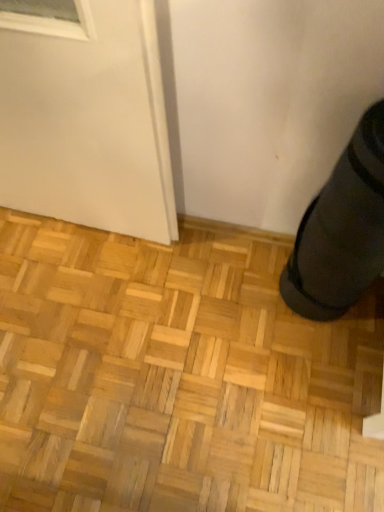
Identify the location of vacant area that is in front of black rubber shoe at lower right. (324, 350).